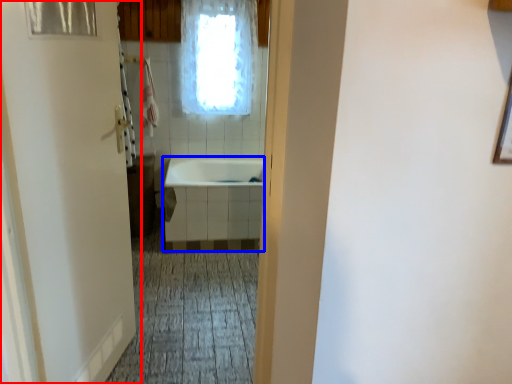
Question: Which of the following is the farthest to the observer, door (highlighted by a red box) or bath (highlighted by a blue box)?

Choices:
 (A) door
 (B) bath

Answer: (B)